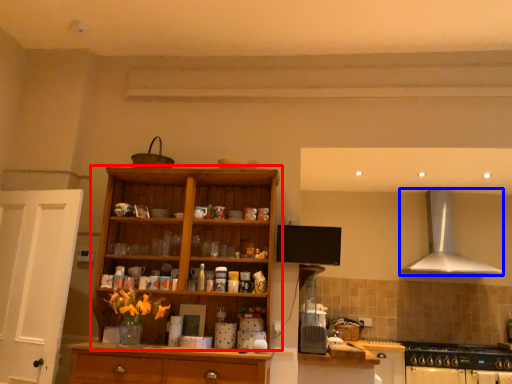
Question: Which object is closer to the camera taking this photo, cupboard (highlighted by a red box) or kitchen appliance (highlighted by a blue box)?

Choices:
 (A) cupboard
 (B) kitchen appliance

Answer: (A)